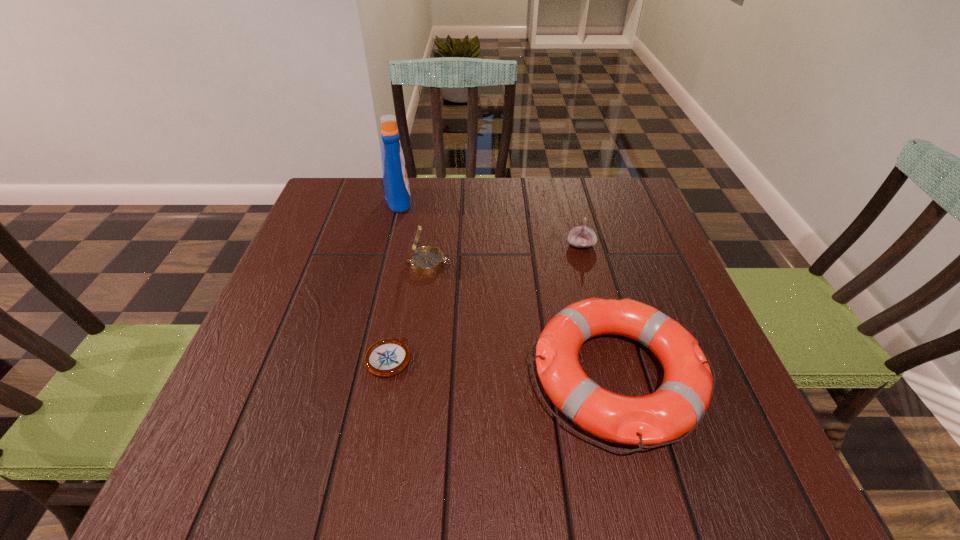
The height and width of the screenshot is (540, 960). Identify the location of the tallest object. (396, 185).

Find the location of a particular element. The width and height of the screenshot is (960, 540). the farthest object is located at coordinates (396, 185).

I want to click on the farther compass, so pyautogui.click(x=424, y=260).

You are a GUI agent. You are given a task and a screenshot of the screen. Output one action in this format:
    pyautogui.click(x=<x>, y=<y>)
    Task: Click on the taller compass
    The height and width of the screenshot is (540, 960).
    Given the screenshot: What is the action you would take?
    pyautogui.click(x=424, y=260)

The width and height of the screenshot is (960, 540). In order to click on garlic in this screenshot , I will do click(581, 237).

You are a GUI agent. You are given a task and a screenshot of the screen. Output one action in this format:
    pyautogui.click(x=<x>, y=<y>)
    Task: Click on the life buoy
    
    Given the screenshot: What is the action you would take?
    click(x=678, y=406)

Where is `the shorter compass`? Image resolution: width=960 pixels, height=540 pixels. the shorter compass is located at coordinates (387, 357).

The height and width of the screenshot is (540, 960). What are the coordinates of `the nearer compass` in the screenshot? It's located at (387, 357).

Locate an element on the screen. This screenshot has width=960, height=540. vacant space situated 0.320m on the label of the farthest object is located at coordinates [529, 200].

The height and width of the screenshot is (540, 960). What are the coordinates of `vacant region located 0.120m with the dial facing the taller compass` in the screenshot? It's located at (503, 263).